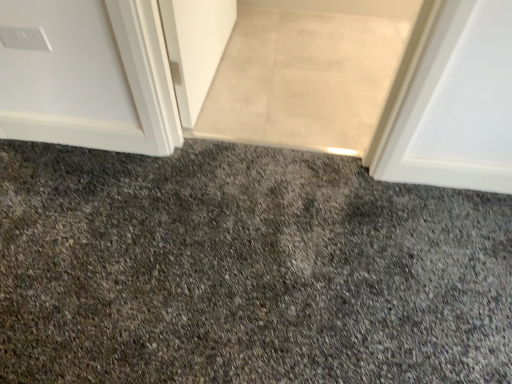
The width and height of the screenshot is (512, 384). What do you see at coordinates (307, 73) in the screenshot?
I see `gray carpet at center` at bounding box center [307, 73].

You are a GUI agent. You are given a task and a screenshot of the screen. Output one action in this format:
    pyautogui.click(x=<x>, y=<y>)
    Task: Click on the gray carpet at center
    Image resolution: width=512 pixels, height=384 pixels.
    Given the screenshot: What is the action you would take?
    pyautogui.click(x=307, y=73)

Identify the location of gray textured carpet at center. This screenshot has height=384, width=512. (245, 270).

Image resolution: width=512 pixels, height=384 pixels. Describe the element at coordinates (245, 270) in the screenshot. I see `gray textured carpet at center` at that location.

Where is `gray carpet at center`? Image resolution: width=512 pixels, height=384 pixels. gray carpet at center is located at coordinates (307, 73).

Which is more to the left, gray carpet at center or gray textured carpet at center?

gray textured carpet at center.

Between gray carpet at center and gray textured carpet at center, which one is positioned behind?

gray carpet at center is behind.

Is point (286, 7) closer to camera compared to point (333, 320)?

That is False.

Consider the image. From the image's perspective, is gray carpet at center over gray textured carpet at center?

Indeed, from the image's perspective, gray carpet at center is shown above gray textured carpet at center.

From a real-world perspective, is gray carpet at center physically below gray textured carpet at center?

Yes, from a real-world perspective, gray carpet at center is below gray textured carpet at center.

Between gray carpet at center and gray textured carpet at center, which one has larger width?

gray carpet at center.

Is gray carpet at center shorter than gray textured carpet at center?

Incorrect, the height of gray carpet at center does not fall short of that of gray textured carpet at center.

Which of these two, gray carpet at center or gray textured carpet at center, is bigger?

gray textured carpet at center is bigger.

Choose the correct answer: Is gray carpet at center inside gray textured carpet at center or outside it?

gray carpet at center cannot be found inside gray textured carpet at center.

Is gray carpet at center touching gray textured carpet at center?

gray carpet at center and gray textured carpet at center are clearly separated.

Could you tell me if gray carpet at center is turned towards gray textured carpet at center?

Yes, gray carpet at center is oriented towards gray textured carpet at center.

What's the angular difference between gray carpet at center and gray textured carpet at center's facing directions?

180 degrees.

How distant is gray carpet at center from gray textured carpet at center?

They are 25.98 inches apart.

Image resolution: width=512 pixels, height=384 pixels. I want to click on doormat on the right of gray textured carpet at center, so click(307, 73).

Can you confirm if gray textured carpet at center is positioned to the right of gray carpet at center?

No.

Is gray textured carpet at center further to camera compared to gray carpet at center?

No, gray textured carpet at center is in front of gray carpet at center.

Does point (273, 208) appear closer or farther from the camera than point (314, 66)?

Point (273, 208) is positioned closer to the camera compared to point (314, 66).

From the image's perspective, is gray textured carpet at center beneath gray carpet at center?

Yes, from the image's perspective, gray textured carpet at center is beneath gray carpet at center.

From a real-world perspective, does gray textured carpet at center sit lower than gray carpet at center?

Actually, gray textured carpet at center is physically above gray carpet at center in the real world.

Which of these two, gray textured carpet at center or gray carpet at center, is thinner?

gray textured carpet at center is thinner.

From their relative heights in the image, would you say gray textured carpet at center is taller or shorter than gray carpet at center?

gray textured carpet at center is shorter than gray carpet at center.

Based on the photo, does gray textured carpet at center have a smaller size compared to gray carpet at center?

No.

Is gray textured carpet at center located outside gray carpet at center?

Yes.

Is gray textured carpet at center positioned far away from gray carpet at center?

No, gray textured carpet at center is in close proximity to gray carpet at center.

Is gray carpet at center at the back of gray textured carpet at center?

No, gray textured carpet at center is not facing the opposite direction of gray carpet at center.

You are a GUI agent. You are given a task and a screenshot of the screen. Output one action in this format:
    pyautogui.click(x=<x>, y=<y>)
    Task: Click on the doormat on the right of gray textured carpet at center
    The image size is (512, 384).
    Given the screenshot: What is the action you would take?
    pyautogui.click(x=307, y=73)

Identify the location of doormat to the right of gray textured carpet at center. This screenshot has width=512, height=384. (307, 73).

Locate an element on the screen. Image resolution: width=512 pixels, height=384 pixels. doormat located behind the gray textured carpet at center is located at coordinates (307, 73).